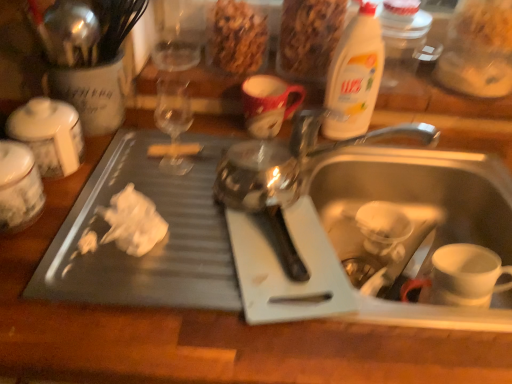
Locate an element on the screen. This screenshot has width=512, height=384. vacant space situated on the left part of matte ceramic mug at upper center is located at coordinates pyautogui.click(x=185, y=136).